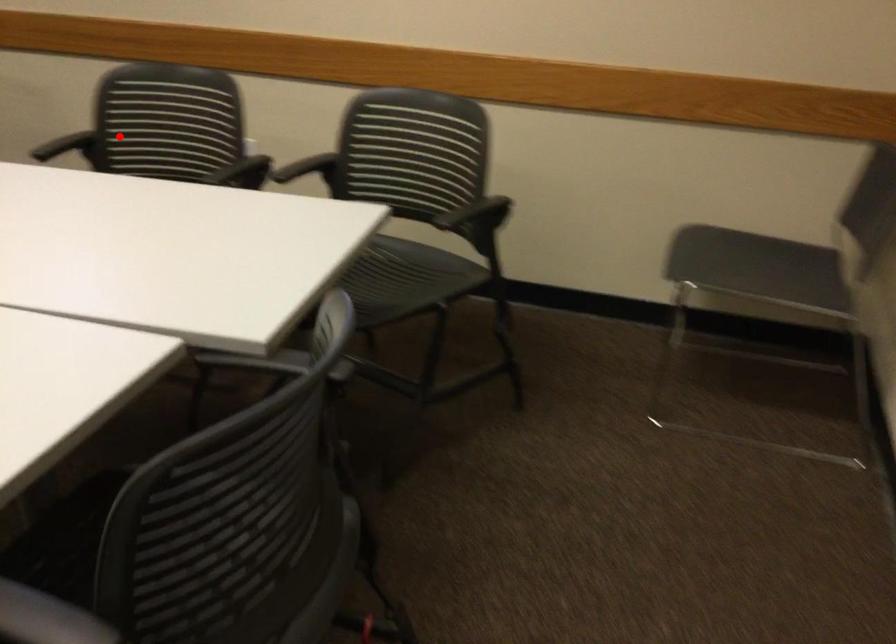
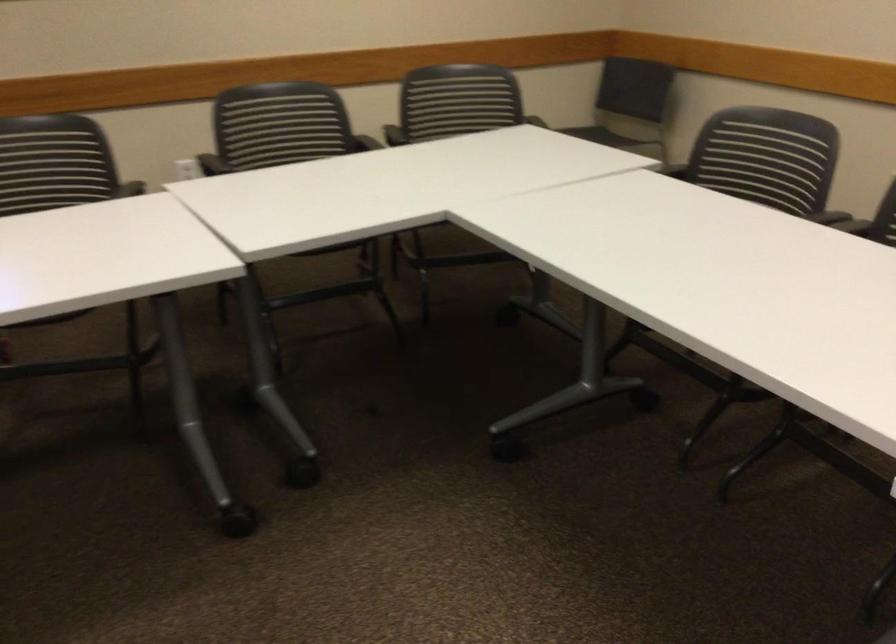
In the second image, find the point that corresponds to the highlighted location in the first image.

(211, 164)